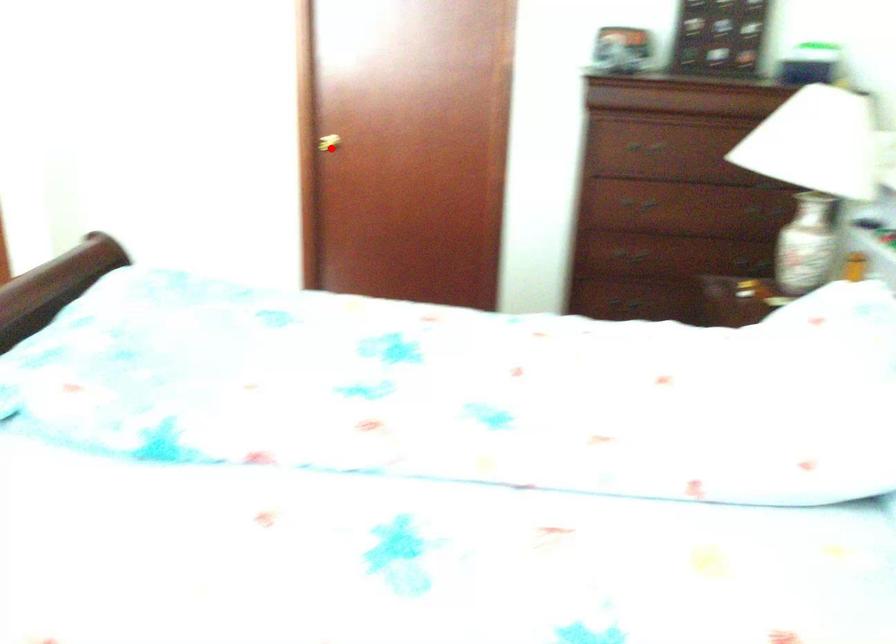
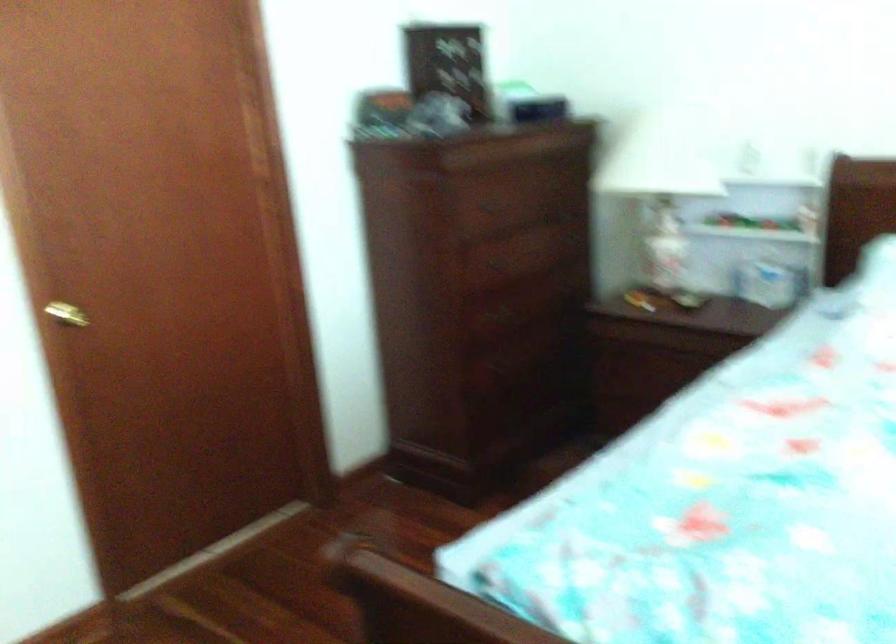
Question: A red point is marked in image1. In image2, is the corresponding 3D point closer to the camera or farther? Reply with the corresponding letter.

Choices:
 (A) The corresponding 3D point is closer.
 (B) The corresponding 3D point is farther.

Answer: (A)